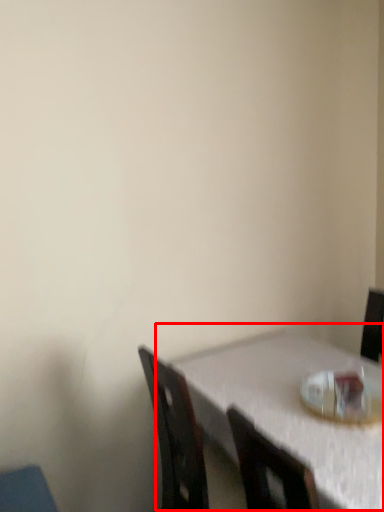
Question: From the image's perspective, where is table (annotated by the red box) located relative to tableware?

Choices:
 (A) below
 (B) above

Answer: (A)